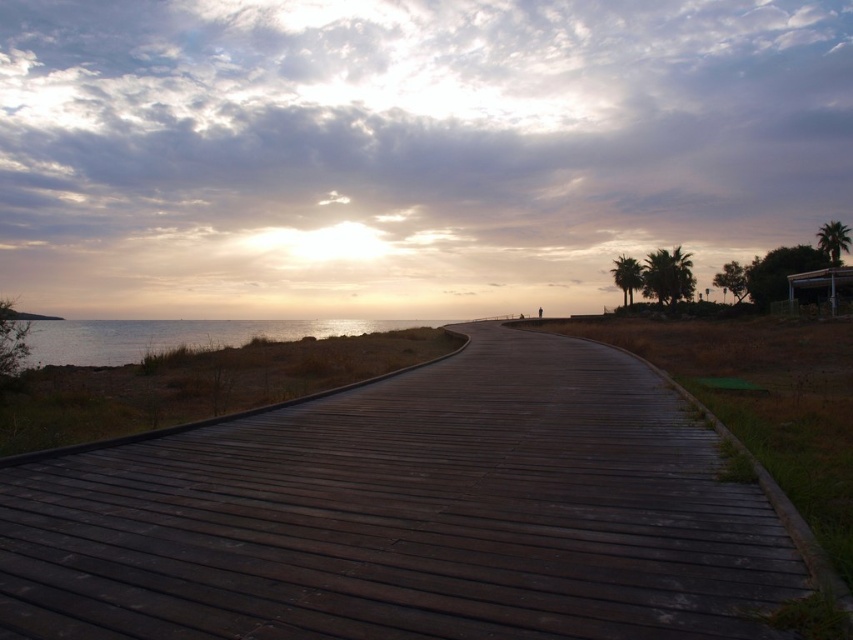
Is point (281, 506) more distant than point (457, 321)?

No, (281, 506) is closer to viewer.

The height and width of the screenshot is (640, 853). What do you see at coordinates (407, 515) in the screenshot? I see `dark brown wooden path at center` at bounding box center [407, 515].

At what (x,y) coordinates should I click in order to perform the action: click on dark brown wooden path at center. Please return your answer as a coordinate pair (x, y). Looking at the image, I should click on (407, 515).